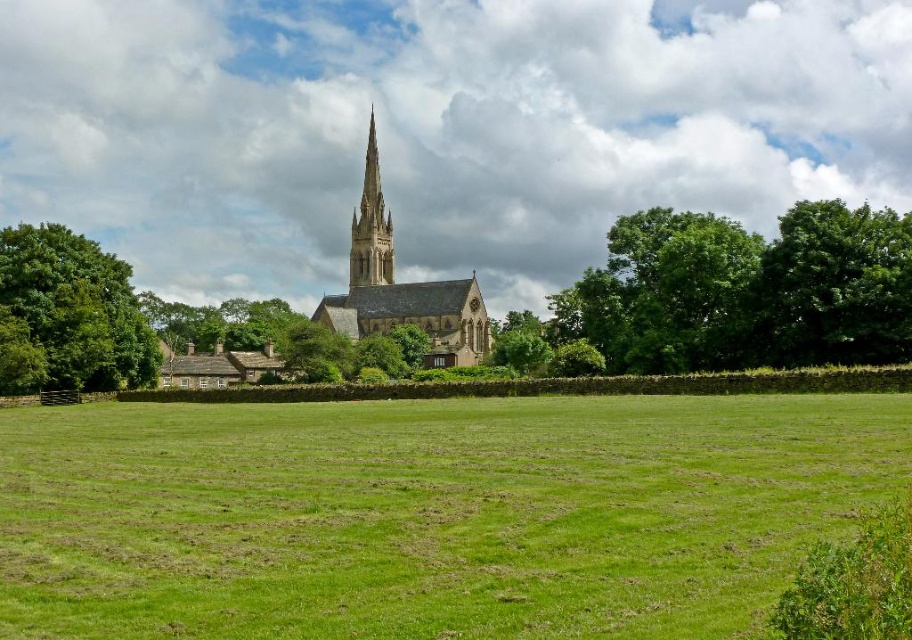
Question: Among these points, which one is farthest from the camera?

Choices:
 (A) pos(231,522)
 (B) pos(361,224)
 (C) pos(900,272)

Answer: (B)

Question: Observing the image, what is the correct spatial positioning of green grass at center in reference to green leafy tree at right?

Choices:
 (A) above
 (B) below

Answer: (B)

Question: Does green leafy tree at center have a smaller size compared to smooth stone spire at center?

Choices:
 (A) no
 (B) yes

Answer: (A)

Question: Is green leafy tree at right positioned at the back of green leafy tree at left?

Choices:
 (A) no
 (B) yes

Answer: (A)

Question: Which object is positioned farthest from the green leafy tree at right?

Choices:
 (A) green grass at center
 (B) green leafy tree at left

Answer: (B)

Question: Which is nearer to the green leafy tree at right?

Choices:
 (A) stone church steeple at center
 (B) green grass at center
 (C) green leafy tree at left

Answer: (B)